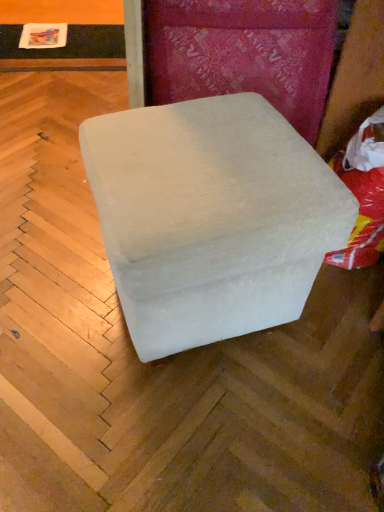
Question: Considering their positions, is white fabric ottoman at center located in front of or behind white fabric bean bag at right?

Choices:
 (A) front
 (B) behind

Answer: (A)

Question: Is point click(x=193, y=111) closer or farther from the camera than point click(x=382, y=153)?

Choices:
 (A) farther
 (B) closer

Answer: (B)

Question: Is white fabric ottoman at center bigger or smaller than white fabric bean bag at right?

Choices:
 (A) big
 (B) small

Answer: (A)

Question: Is white fabric bean bag at right in front of or behind white fabric ottoman at center in the image?

Choices:
 (A) front
 (B) behind

Answer: (B)

Question: Choose the correct answer: Is white fabric bean bag at right inside white fabric ottoman at center or outside it?

Choices:
 (A) inside
 (B) outside

Answer: (B)

Question: Considering the positions of white fabric bean bag at right and white fabric ottoman at center in the image, is white fabric bean bag at right wider or thinner than white fabric ottoman at center?

Choices:
 (A) wide
 (B) thin

Answer: (B)

Question: Is white fabric bean bag at right bigger or smaller than white fabric ottoman at center?

Choices:
 (A) big
 (B) small

Answer: (B)